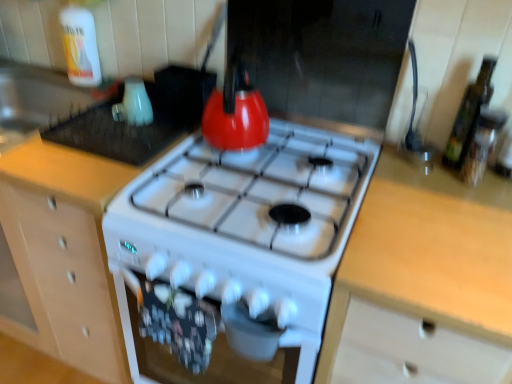
Identify the location of free spot to the left of white glossy kettle at upper left, placed as the 2th appliance when sorted from right to left. Image resolution: width=512 pixels, height=384 pixels. (88, 119).